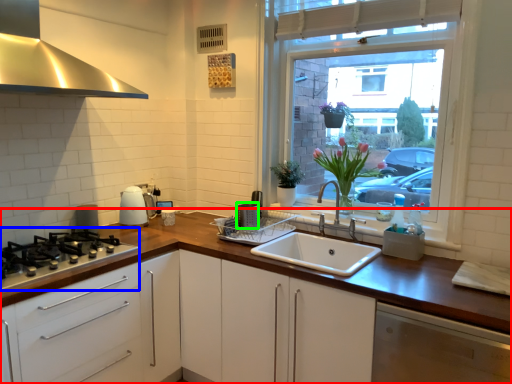
Question: Which object is positioned closest to countertop (highlighted by a red box)? Select from gas stove (highlighted by a blue box) and appliance (highlighted by a green box).

Choices:
 (A) gas stove
 (B) appliance

Answer: (A)